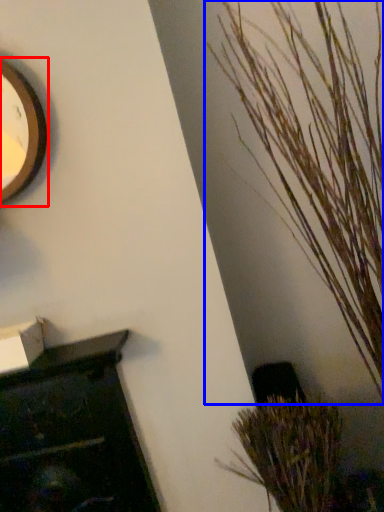
Question: Which object is closer to the camera taking this photo, clock (highlighted by a red box) or houseplant (highlighted by a blue box)?

Choices:
 (A) clock
 (B) houseplant

Answer: (B)